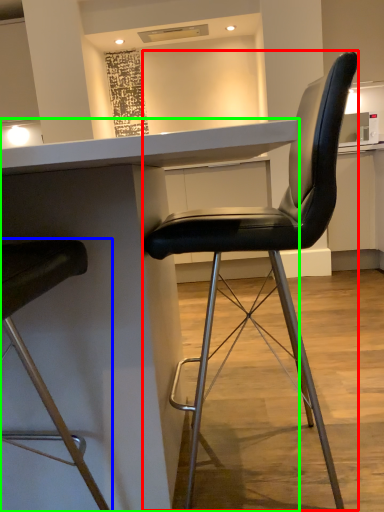
Question: Based on their relative distances, which object is nearer to chair (highlighted by a red box)? Choose from chair (highlighted by a blue box) and table (highlighted by a green box).

Choices:
 (A) chair
 (B) table

Answer: (B)